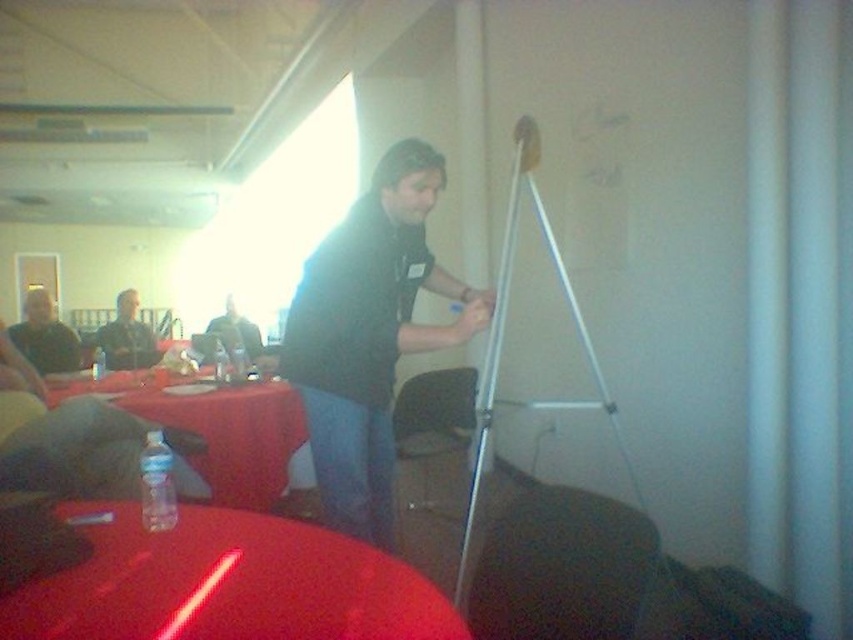
Question: Which object is farther from the camera taking this photo?

Choices:
 (A) matte black shirt at center
 (B) black matte shirt at center
 (C) metallic silver tripod at right

Answer: (A)

Question: Is glossy plastic table at lower left thinner than black matte shirt at center?

Choices:
 (A) no
 (B) yes

Answer: (A)

Question: Which point is farther to the camera?

Choices:
 (A) matte black shirt at left
 (B) glossy plastic table at lower left
 (C) matte black shirt at upper left

Answer: (C)

Question: Estimate the real-world distances between objects in this image. Which object is closer to the matte black shirt at center?

Choices:
 (A) black matte shirt at center
 (B) matte black shirt at upper left
 (C) glossy plastic table at lower left

Answer: (B)

Question: Does matte black shirt at upper left come behind matte black shirt at center?

Choices:
 (A) yes
 (B) no

Answer: (A)

Question: Is translucent plastic bottle at lower left above metallic silver tripod at right?

Choices:
 (A) yes
 (B) no

Answer: (B)